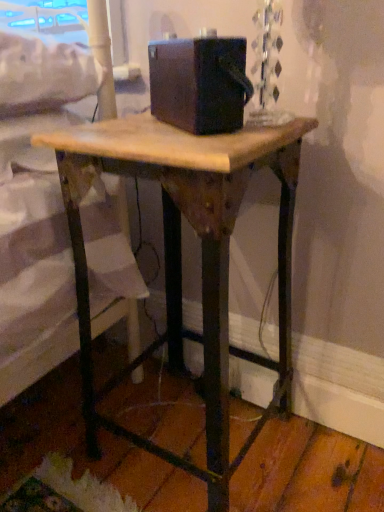
Question: From the image's perspective, is matte black box at center over wooden table at center?

Choices:
 (A) no
 (B) yes

Answer: (B)

Question: From a real-world perspective, is matte black box at center located higher than wooden table at center?

Choices:
 (A) yes
 (B) no

Answer: (A)

Question: Is matte black box at center thinner than wooden table at center?

Choices:
 (A) no
 (B) yes

Answer: (B)

Question: Is matte black box at center located outside wooden table at center?

Choices:
 (A) no
 (B) yes

Answer: (B)

Question: Would you say wooden table at center is part of matte black box at center's contents?

Choices:
 (A) yes
 (B) no

Answer: (B)

Question: From the image's perspective, is matte black box at center beneath wooden table at center?

Choices:
 (A) no
 (B) yes

Answer: (A)

Question: Is wooden table at center bigger than matte black box at center?

Choices:
 (A) yes
 (B) no

Answer: (A)

Question: Is wooden table at center wider than matte black box at center?

Choices:
 (A) no
 (B) yes

Answer: (B)

Question: Is wooden table at center taller than matte black box at center?

Choices:
 (A) no
 (B) yes

Answer: (B)

Question: Is wooden table at center oriented towards matte black box at center?

Choices:
 (A) no
 (B) yes

Answer: (A)

Question: From a real-world perspective, is wooden table at center located higher than matte black box at center?

Choices:
 (A) yes
 (B) no

Answer: (B)

Question: Is wooden table at center to the right of matte black box at center from the viewer's perspective?

Choices:
 (A) no
 (B) yes

Answer: (A)

Question: Is matte black box at center wider or thinner than wooden table at center?

Choices:
 (A) thin
 (B) wide

Answer: (A)